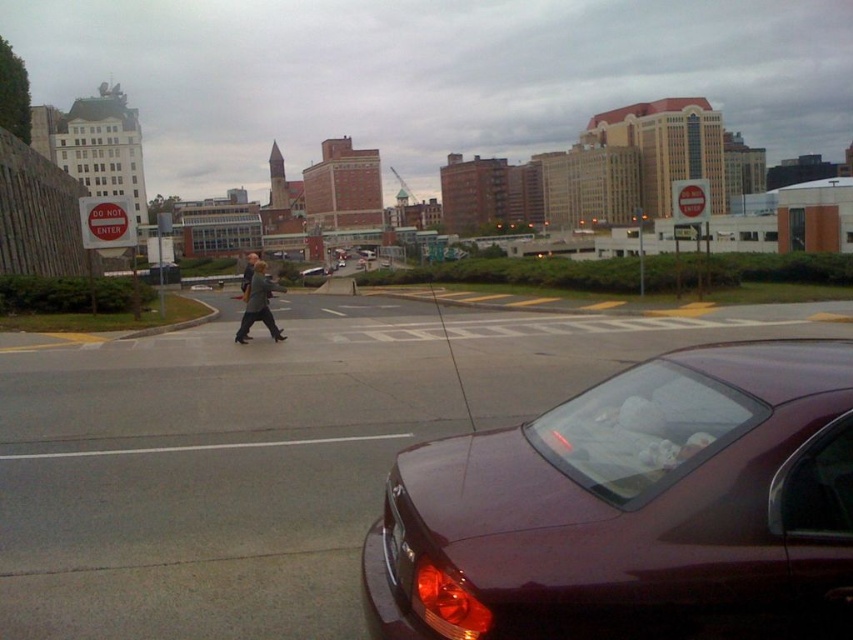
Is the position of glossy maroon car at lower right less distant than that of dark gray jacket at center?

Yes, it is in front of dark gray jacket at center.

Which is more to the left, glossy maroon car at lower right or dark gray jacket at center?

dark gray jacket at center

Locate an element on the screen. This screenshot has width=853, height=640. glossy maroon car at lower right is located at coordinates (x=634, y=509).